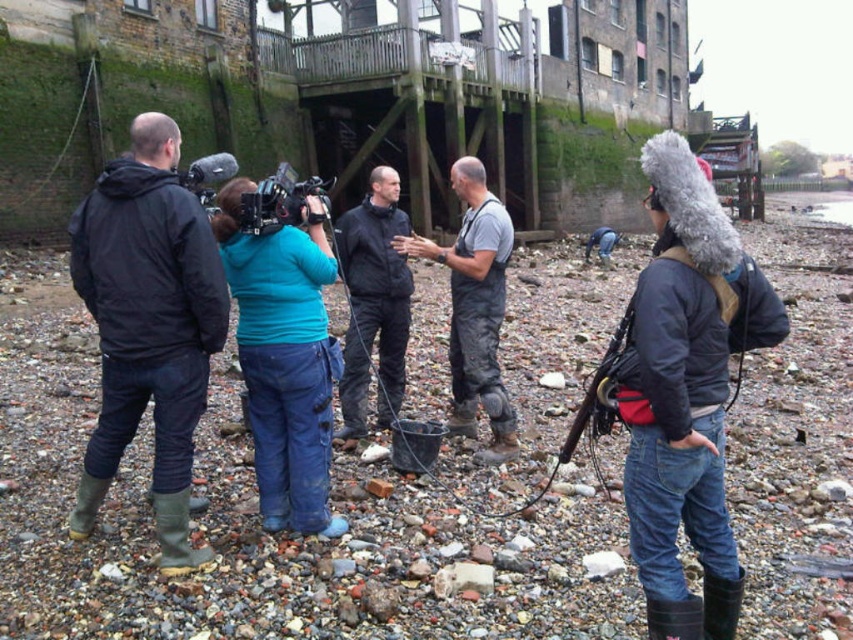
What do you see at coordinates (474, 307) in the screenshot? I see `camouflage-patterned waders at center` at bounding box center [474, 307].

Is camouflage-patterned waders at center below matte black video camera at center?

Yes, camouflage-patterned waders at center is below matte black video camera at center.

Does point (480, 333) come closer to viewer compared to point (209, 177)?

That is False.

Locate an element on the screen. The image size is (853, 640). camouflage-patterned waders at center is located at coordinates (474, 307).

Is teal fabric jacket at center further to the viewer compared to black plastic video camera at center?

No, teal fabric jacket at center is closer to the viewer.

Who is higher up, teal fabric jacket at center or black plastic video camera at center?

black plastic video camera at center

Who is more distant from viewer, [225,264] or [265,220]?

Point [225,264]

This screenshot has height=640, width=853. What are the coordinates of `teal fabric jacket at center` in the screenshot? It's located at (283, 358).

Which is in front, point (699, 168) or point (337, 365)?

Point (699, 168)

Consider the image. Does dark gray jacket at center have a smaller size compared to teal fabric jacket at center?

Correct, dark gray jacket at center occupies less space than teal fabric jacket at center.

This screenshot has height=640, width=853. I want to click on dark gray jacket at center, so [x=686, y=392].

In order to click on dark gray jacket at center in this screenshot , I will do point(686,392).